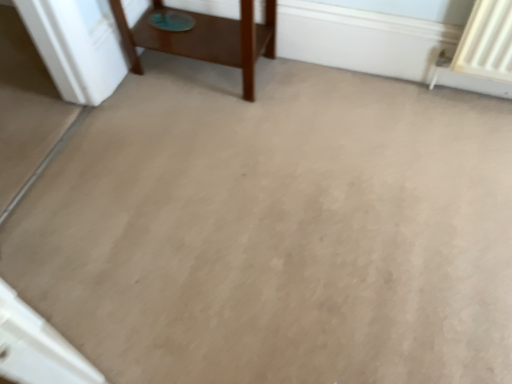
Question: Should I look upward or downward to see brown wooden table at upper left?

Choices:
 (A) down
 (B) up

Answer: (B)